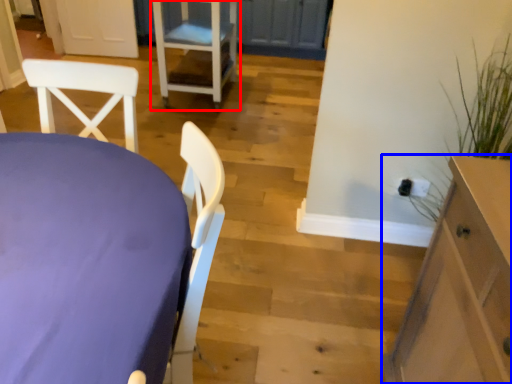
Question: Which point is further to the camera, chair (highlighted by a red box) or cabinetry (highlighted by a blue box)?

Choices:
 (A) chair
 (B) cabinetry

Answer: (A)